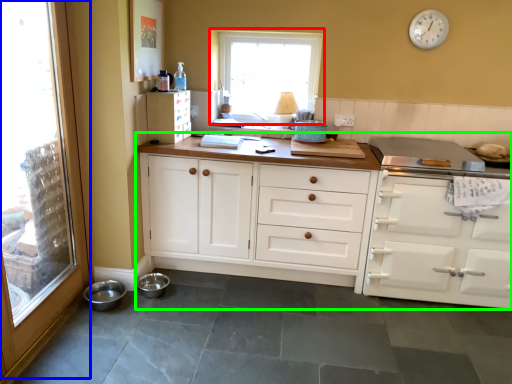
Question: Which object is positioned farthest from window (highlighted by a red box)? Select from glass door (highlighted by a blue box) and cabinetry (highlighted by a green box).

Choices:
 (A) glass door
 (B) cabinetry

Answer: (A)